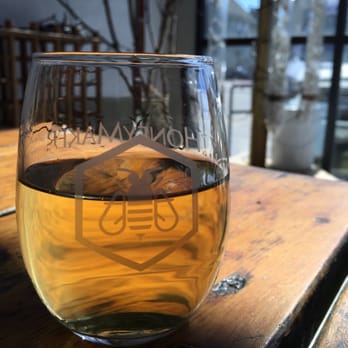
You are a GUI agent. You are given a task and a screenshot of the screen. Output one action in this format:
    pyautogui.click(x=<x>, y=<y>)
    Task: Click on the black edge on the right side of the table
    The width and height of the screenshot is (348, 348).
    Given the screenshot: What is the action you would take?
    pyautogui.click(x=300, y=332)